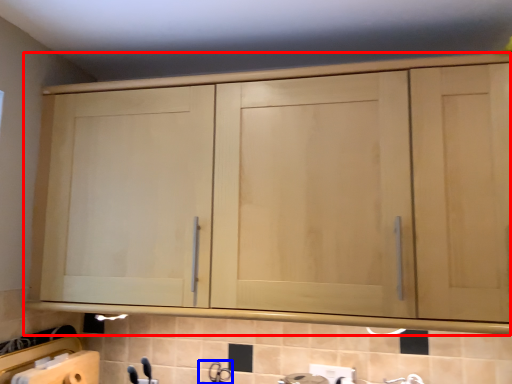
Question: Which object appears closest to the camera in this image, cupboard (highlighted by a red box) or faucet (highlighted by a blue box)?

Choices:
 (A) cupboard
 (B) faucet

Answer: (A)